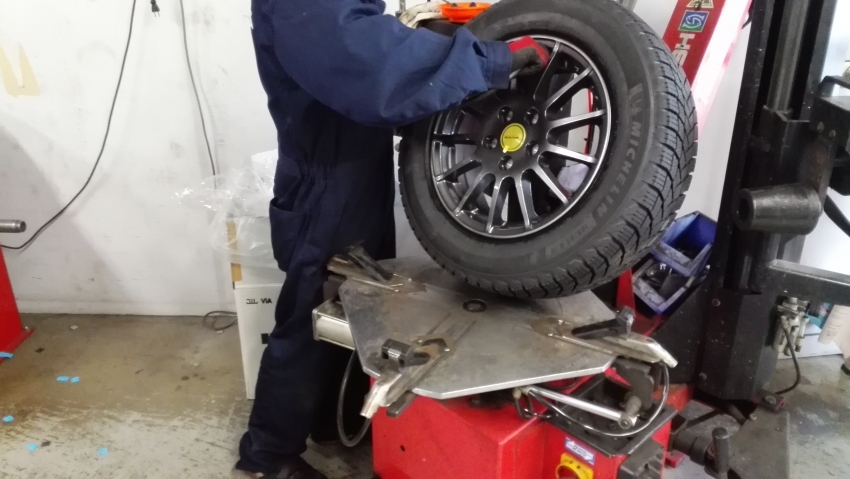
This screenshot has width=850, height=479. I want to click on wires, so click(128, 46), click(189, 67), click(797, 375), click(663, 397).